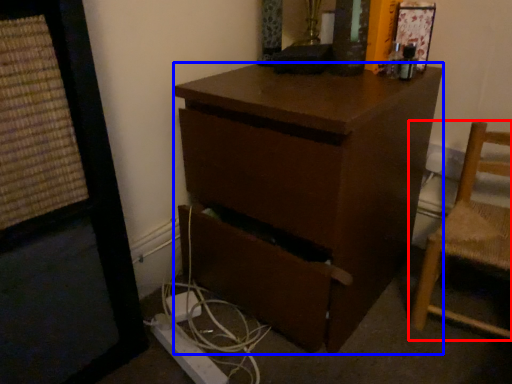
Question: Which object is further to the camera taking this photo, chair (highlighted by a red box) or desk (highlighted by a blue box)?

Choices:
 (A) chair
 (B) desk

Answer: (A)